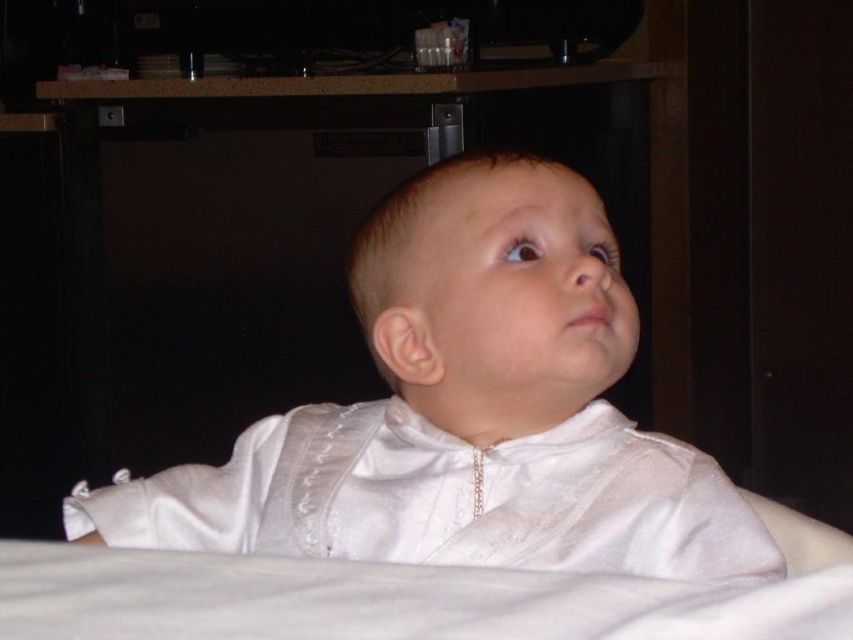
Question: Is white satin baby at center above white satin robe at center?

Choices:
 (A) no
 (B) yes

Answer: (B)

Question: In this image, where is white satin baby at center located relative to white satin robe at center?

Choices:
 (A) right
 (B) left

Answer: (B)

Question: Among these objects, which one is farthest from the camera?

Choices:
 (A) white satin robe at center
 (B) white satin baby at center

Answer: (A)

Question: Does white satin baby at center appear under white satin robe at center?

Choices:
 (A) yes
 (B) no

Answer: (B)